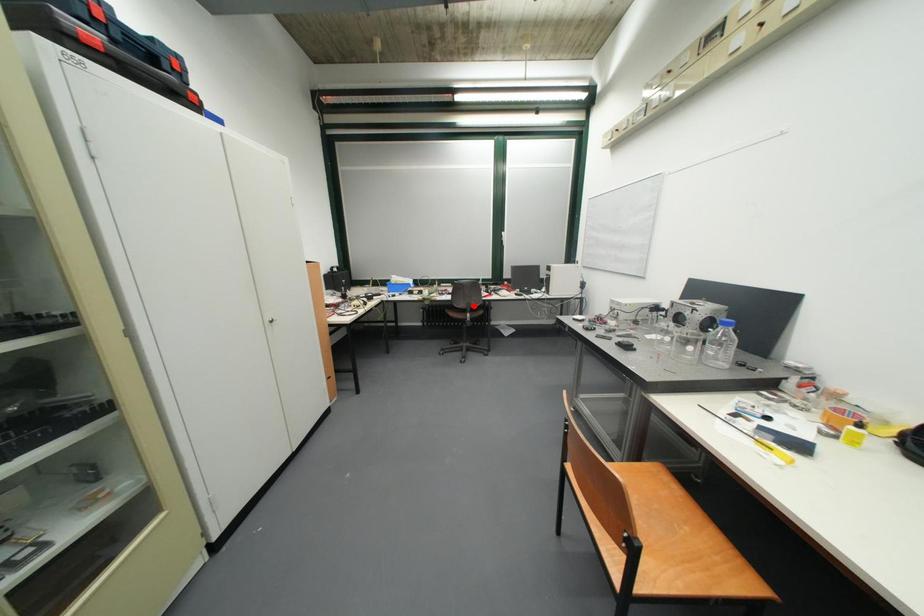
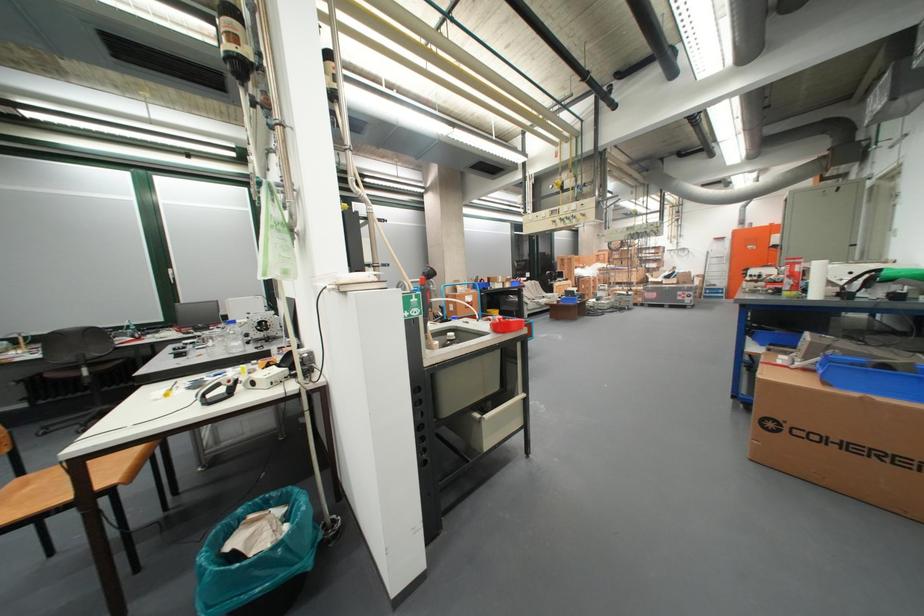
The point at the highlighted location is marked in the first image. Where is the corresponding point in the second image?

(79, 360)